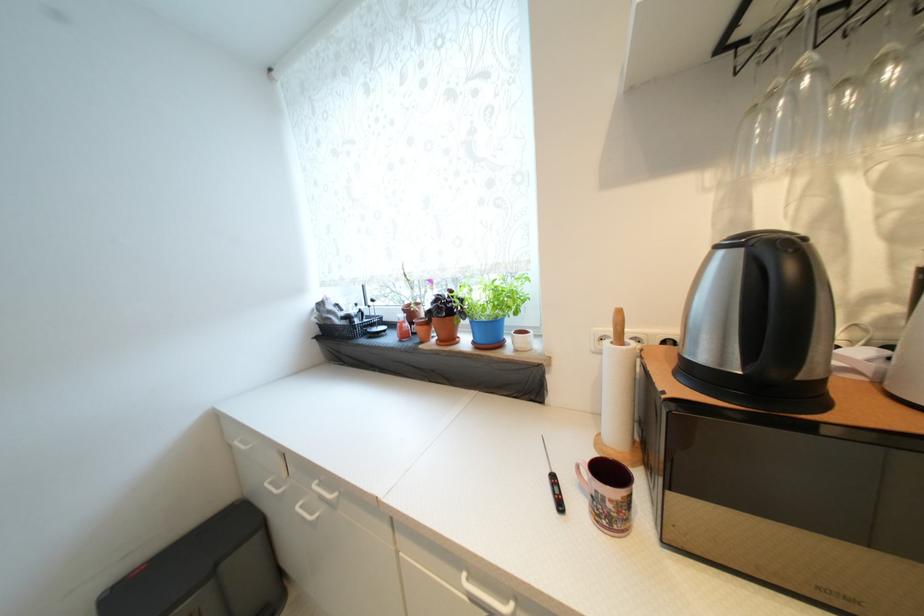
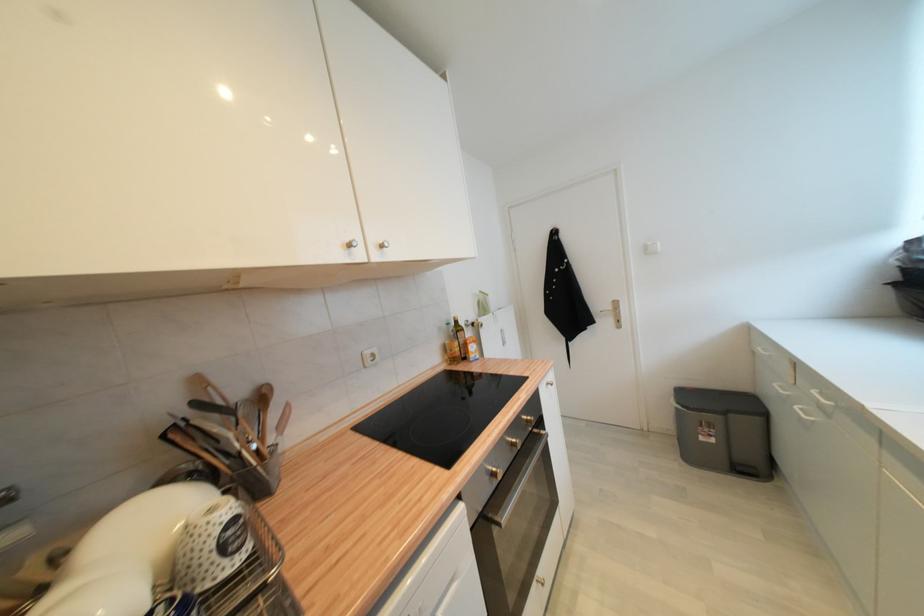
Question: The first image is from the beginning of the video and the second image is from the end. How did the camera likely rotate when shooting the video?

Choices:
 (A) Left
 (B) Right
 (C) Up
 (D) Down

Answer: (A)